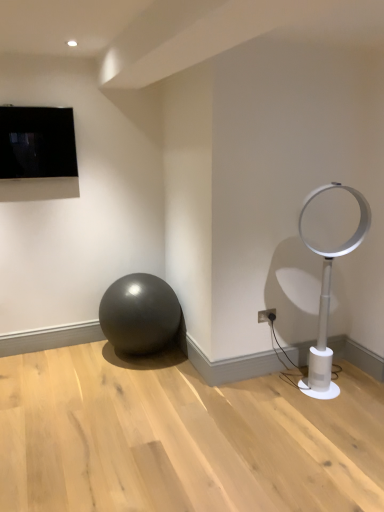
Where is `vacant area situated below black glossy tv at upper left (from a real-world perspective)`? vacant area situated below black glossy tv at upper left (from a real-world perspective) is located at coordinates (64, 345).